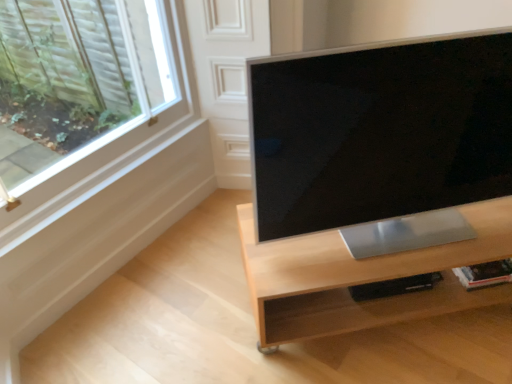
This screenshot has width=512, height=384. I want to click on vacant space to the left of light wood/finish tv stand at center, so click(x=187, y=303).